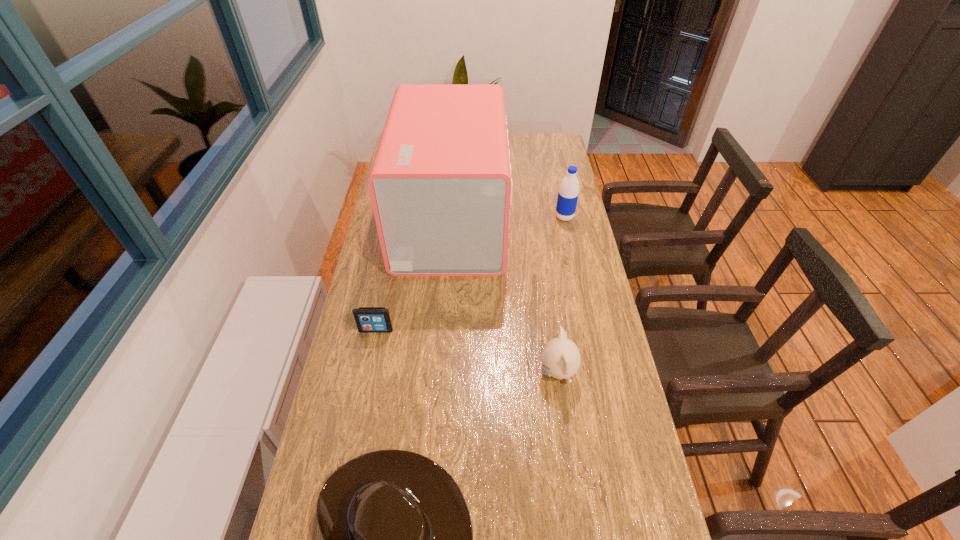
At what (x,y) coordinates should I click in order to perform the action: click on free space between the kitten and the box. Please return your answer as a coordinate pair (x, y). The height and width of the screenshot is (540, 960). Looking at the image, I should click on (504, 296).

Locate an element on the screen. Image resolution: width=960 pixels, height=540 pixels. free space that is in between the box and the third tallest object is located at coordinates (504, 296).

Image resolution: width=960 pixels, height=540 pixels. I want to click on unoccupied position between the second tallest object and the fourth object from left to right, so click(x=561, y=295).

Find the location of `vacant area that lies between the water bottle and the fourth farthest object`. vacant area that lies between the water bottle and the fourth farthest object is located at coordinates (561, 295).

The width and height of the screenshot is (960, 540). Identify the location of free space between the third shortest object and the second tallest object. (561, 295).

Point out which object is positioned as the nearest to the tallest object. Please provide its 2D coordinates. Your answer should be formatted as a tuple, i.e. [(x, y)], where the tuple contains the x and y coordinates of a point satisfying the conditions above.

[(568, 193)]

Locate which object is the second closest to the second nearest object. Please provide its 2D coordinates. Your answer should be formatted as a tuple, i.e. [(x, y)], where the tuple contains the x and y coordinates of a point satisfying the conditions above.

[(440, 184)]

The height and width of the screenshot is (540, 960). In order to click on free point that satisfies the following two spatial constraints: 1. on the surface of the tallest object where the text is embossed; 2. on the front screen of the iPod in this screenshot , I will do `click(443, 330)`.